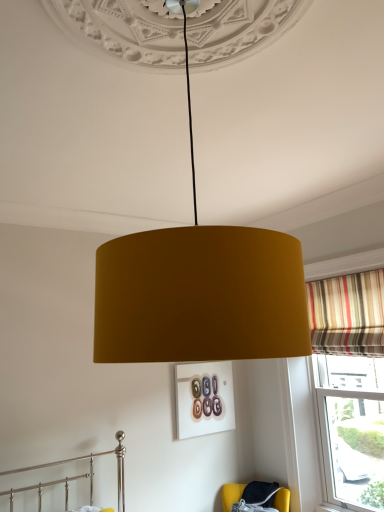
Question: From a real-world perspective, does mustard fabric lampshade at center stand above velvet yellow armchair at lower right?

Choices:
 (A) yes
 (B) no

Answer: (A)

Question: Can you confirm if mustard fabric lampshade at center is shorter than velvet yellow armchair at lower right?

Choices:
 (A) yes
 (B) no

Answer: (B)

Question: Does mustard fabric lampshade at center have a lesser width compared to velvet yellow armchair at lower right?

Choices:
 (A) yes
 (B) no

Answer: (B)

Question: Can you confirm if mustard fabric lampshade at center is wider than velvet yellow armchair at lower right?

Choices:
 (A) yes
 (B) no

Answer: (A)

Question: From a real-world perspective, is mustard fabric lampshade at center positioned under velvet yellow armchair at lower right based on gravity?

Choices:
 (A) yes
 (B) no

Answer: (B)

Question: Are mustard fabric lampshade at center and velvet yellow armchair at lower right far apart?

Choices:
 (A) yes
 (B) no

Answer: (A)

Question: Is velvet yellow armchair at lower right positioned before striped fabric curtain at right?

Choices:
 (A) no
 (B) yes

Answer: (A)

Question: Can you confirm if velvet yellow armchair at lower right is wider than striped fabric curtain at right?

Choices:
 (A) no
 (B) yes

Answer: (B)

Question: Can you confirm if velvet yellow armchair at lower right is smaller than striped fabric curtain at right?

Choices:
 (A) yes
 (B) no

Answer: (B)

Question: From a real-world perspective, is velvet yellow armchair at lower right physically below striped fabric curtain at right?

Choices:
 (A) yes
 (B) no

Answer: (A)

Question: Is velvet yellow armchair at lower right next to striped fabric curtain at right and touching it?

Choices:
 (A) yes
 (B) no

Answer: (B)

Question: Is velvet yellow armchair at lower right surrounding striped fabric curtain at right?

Choices:
 (A) yes
 (B) no

Answer: (B)

Question: From a real-world perspective, is striped fabric curtain at right below velvet yellow armchair at lower right?

Choices:
 (A) no
 (B) yes

Answer: (A)